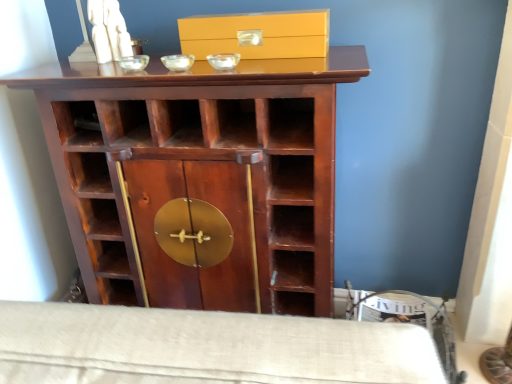
Question: Are matte yellow box at center and mahogany wood cupboard at center making contact?

Choices:
 (A) no
 (B) yes

Answer: (A)

Question: Can you confirm if matte yellow box at center is positioned to the left of mahogany wood cupboard at center?

Choices:
 (A) yes
 (B) no

Answer: (B)

Question: Could mahogany wood cupboard at center be considered to be inside matte yellow box at center?

Choices:
 (A) no
 (B) yes

Answer: (A)

Question: Can you confirm if matte yellow box at center is bigger than mahogany wood cupboard at center?

Choices:
 (A) yes
 (B) no

Answer: (B)

Question: Does matte yellow box at center come behind mahogany wood cupboard at center?

Choices:
 (A) no
 (B) yes

Answer: (B)

Question: Can we say matte yellow box at center lies outside mahogany wood cupboard at center?

Choices:
 (A) no
 (B) yes

Answer: (B)

Question: From the image's perspective, would you say mahogany wood cupboard at center is positioned over matte yellow box at center?

Choices:
 (A) yes
 (B) no

Answer: (B)

Question: Does mahogany wood cupboard at center contain matte yellow box at center?

Choices:
 (A) yes
 (B) no

Answer: (B)

Question: Considering the relative positions of mahogany wood cupboard at center and matte yellow box at center in the image provided, is mahogany wood cupboard at center to the right of matte yellow box at center from the viewer's perspective?

Choices:
 (A) yes
 (B) no

Answer: (B)

Question: Does mahogany wood cupboard at center have a greater height compared to matte yellow box at center?

Choices:
 (A) no
 (B) yes

Answer: (B)

Question: Considering the relative sizes of mahogany wood cupboard at center and matte yellow box at center in the image provided, is mahogany wood cupboard at center wider than matte yellow box at center?

Choices:
 (A) yes
 (B) no

Answer: (A)

Question: Considering the relative sizes of mahogany wood cupboard at center and matte yellow box at center in the image provided, is mahogany wood cupboard at center thinner than matte yellow box at center?

Choices:
 (A) yes
 (B) no

Answer: (B)

Question: Would you say mahogany wood cupboard at center is inside or outside matte yellow box at center?

Choices:
 (A) outside
 (B) inside

Answer: (A)